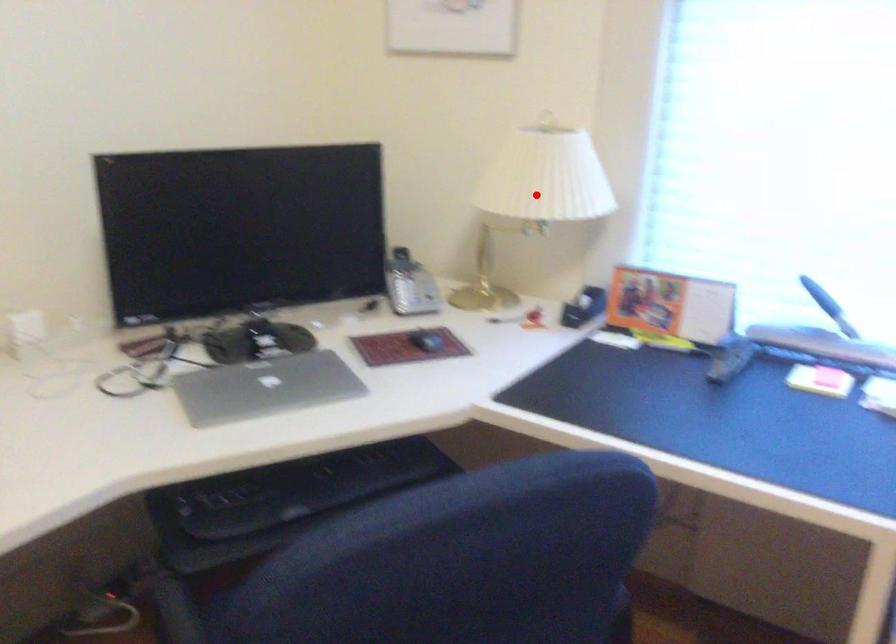
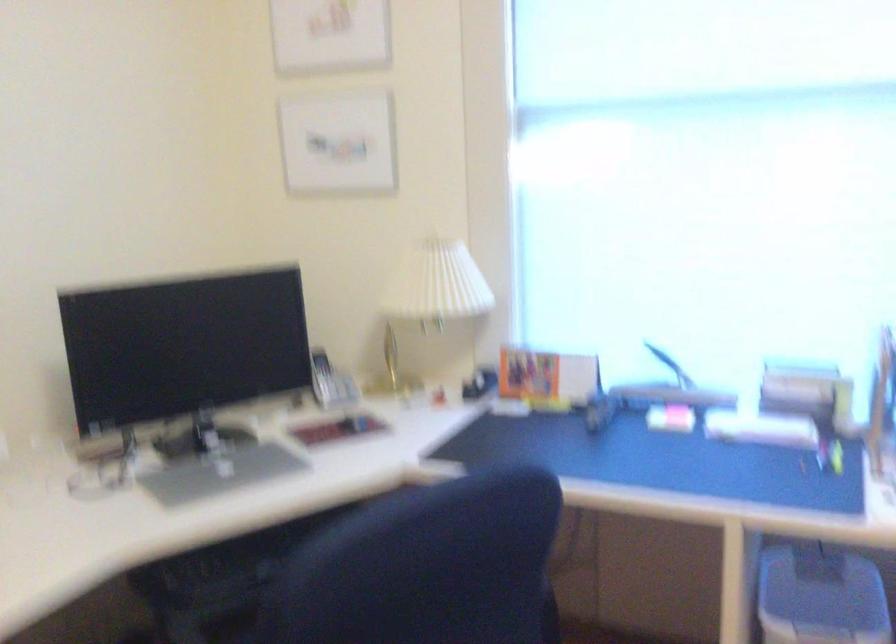
Locate, in the second image, the point that corresponds to the highlighted location in the first image.

(433, 295)